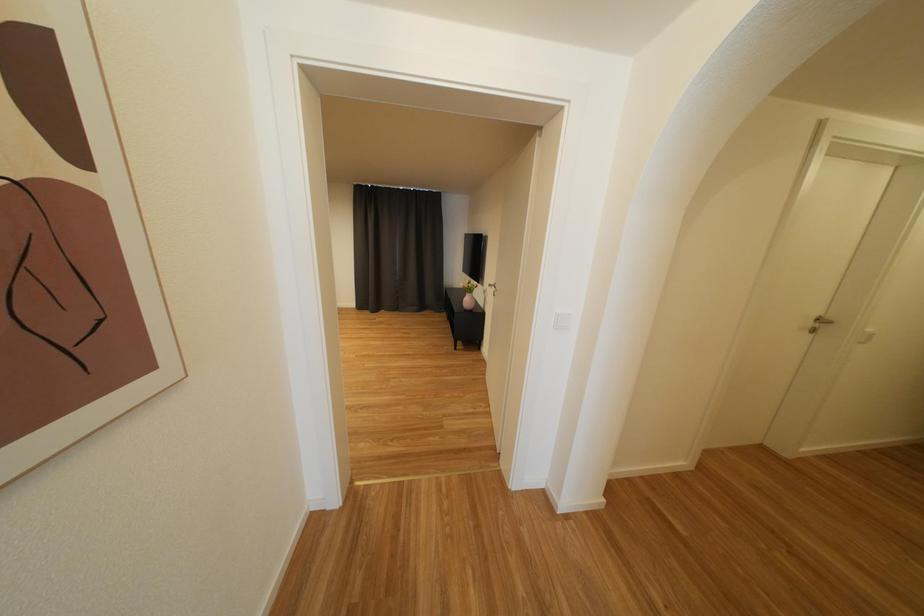
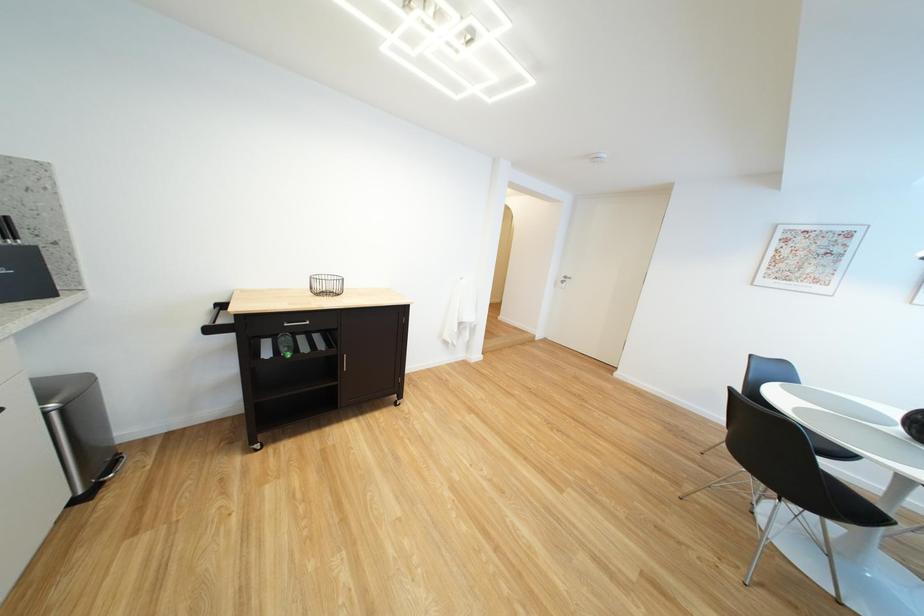
Consider the image. What movement of the cameraman would produce the second image?

The cameraman moved toward left, backward.